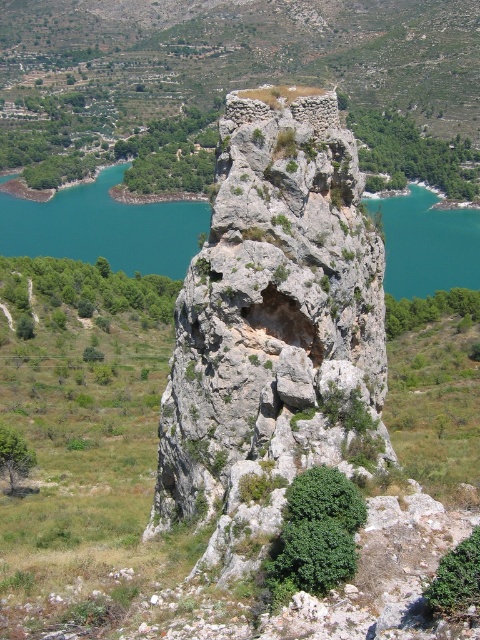
From the picture: You are a hiker trying to navigate through the landscape. You see the green leafy shrubs at upper right and the green leafy bush at lower right. Which one is located higher up in the terrain?

The green leafy shrubs at upper right are located higher up in the terrain than the green leafy bush at lower right.

You are a hiker who wants to take a photo of the gray rough rock at center and the green leafy shrubs at lower left. Which object should you stand closer to in order to capture both in a single frame without zooming in or out?

You should stand closer to the green leafy shrubs at lower left because the gray rough rock at center is much taller than the green leafy shrubs at lower left, so moving closer to the shorter shrubs will help balance their sizes in the photo frame.